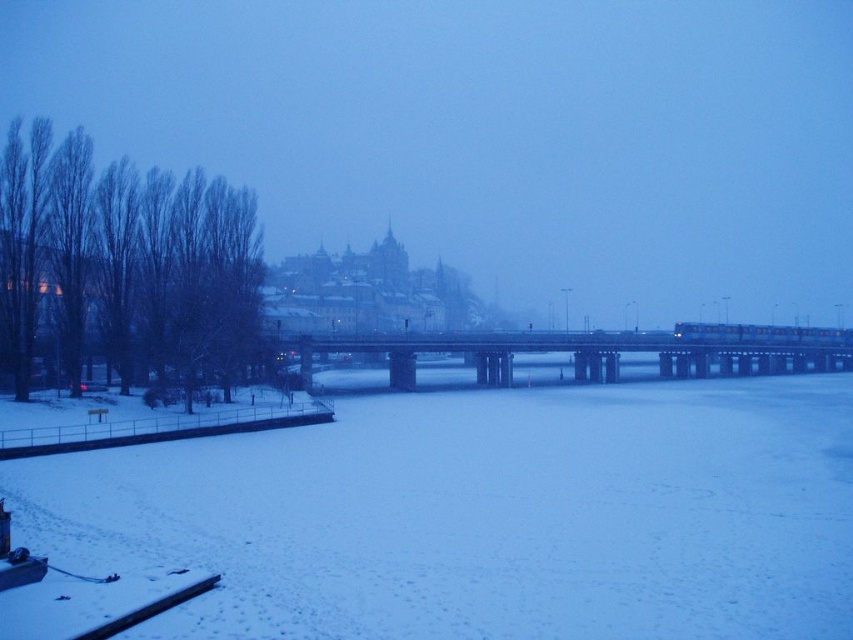
Does white powdery snow at center have a lesser height compared to concrete bridge at center?

Correct, white powdery snow at center is not as tall as concrete bridge at center.

Does white powdery snow at center have a greater height compared to concrete bridge at center?

In fact, white powdery snow at center may be shorter than concrete bridge at center.

In order to click on white powdery snow at center in this screenshot , I will do `click(486, 515)`.